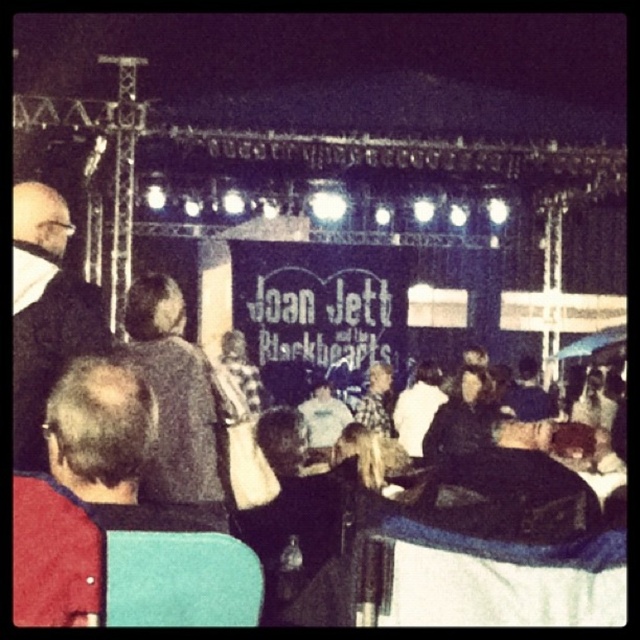
You are at the concert and want to know how far the point marked as point (13, 326) is from where you are standing. Can you determine the distance?

The point marked as point (13, 326) is 48.09 meters away from your current position.

You are a photographer at the concert and want to capture both the dark gray suit at left and the dark gray sweater at center in a single frame. Which clothing item will appear narrower in the photo?

The dark gray suit at left will appear narrower in the photo because it is thinner than the dark gray sweater at center.